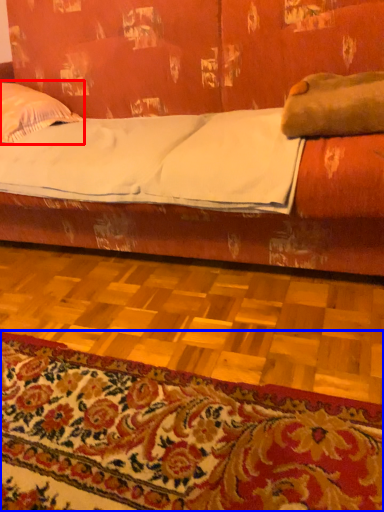
Question: Which object is closer to the camera taking this photo, pillow (highlighted by a red box) or mat (highlighted by a blue box)?

Choices:
 (A) pillow
 (B) mat

Answer: (B)